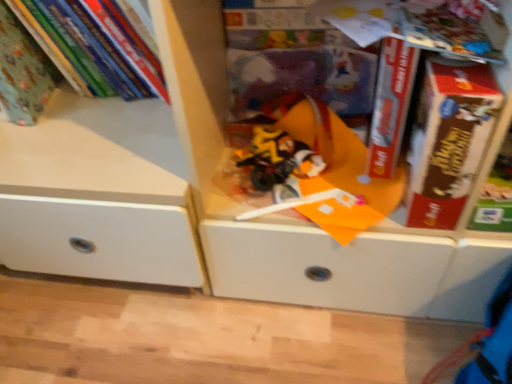
Question: Is red matte book at center, the second paperback book viewed from the right, touching matte green book at upper left, which is the 1th book from right to left?

Choices:
 (A) yes
 (B) no

Answer: (B)

Question: Is red matte book at center, the second paperback book viewed from the right, not near matte green book at upper left, which is the 1th book from right to left?

Choices:
 (A) yes
 (B) no

Answer: (B)

Question: Is matte green book at upper left, which is the 1th book from right to left, located within red matte book at center, the second paperback book viewed from the right?

Choices:
 (A) no
 (B) yes

Answer: (A)

Question: Is red matte book at center, the second paperback book viewed from the right, shorter than matte green book at upper left, arranged as the 2th book when viewed from the left?

Choices:
 (A) no
 (B) yes

Answer: (A)

Question: From the image's perspective, is red matte book at center, the 1th paperback book in the left-to-right sequence, under matte green book at upper left, which is the 1th book from right to left?

Choices:
 (A) yes
 (B) no

Answer: (A)

Question: Is red matte book at center, the second paperback book viewed from the right, taller than matte green book at upper left, which is the 1th book from right to left?

Choices:
 (A) no
 (B) yes

Answer: (B)

Question: Is red matte book at center, the second paperback book viewed from the right, wider than brown cardboard book at right, placed as the second paperback book when sorted from left to right?

Choices:
 (A) yes
 (B) no

Answer: (A)

Question: Is red matte book at center, the second paperback book viewed from the right, completely or partially outside of brown cardboard book at right, placed as the second paperback book when sorted from left to right?

Choices:
 (A) no
 (B) yes

Answer: (B)

Question: From the image's perspective, is red matte book at center, the second paperback book viewed from the right, below brown cardboard book at right, placed as the second paperback book when sorted from left to right?

Choices:
 (A) no
 (B) yes

Answer: (A)

Question: Is there a large distance between red matte book at center, the 1th paperback book in the left-to-right sequence, and brown cardboard book at right, which is the 1th paperback book in right-to-left order?

Choices:
 (A) yes
 (B) no

Answer: (B)

Question: Does red matte book at center, the second paperback book viewed from the right, have a larger size compared to brown cardboard book at right, placed as the second paperback book when sorted from left to right?

Choices:
 (A) yes
 (B) no

Answer: (B)

Question: From the image's perspective, would you say red matte book at center, the 1th paperback book in the left-to-right sequence, is positioned over brown cardboard book at right, placed as the second paperback book when sorted from left to right?

Choices:
 (A) yes
 (B) no

Answer: (A)

Question: Does translucent plastic toy at center appear on the right side of matte green book at upper left, which is counted as the second book, starting from the right?

Choices:
 (A) yes
 (B) no

Answer: (A)